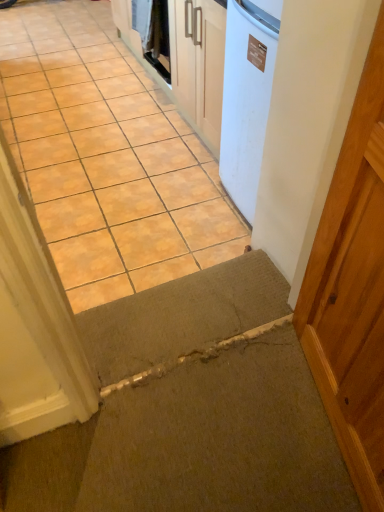
What do you see at coordinates (182, 318) in the screenshot? The image size is (384, 512). I see `carpeted mat at lower center` at bounding box center [182, 318].

Measure the distance between point (x=25, y=138) and camera.

They are 8.94 feet apart.

The width and height of the screenshot is (384, 512). What do you see at coordinates (152, 26) in the screenshot?
I see `white glossy washing machine at upper center` at bounding box center [152, 26].

Where is `carpeted mat at lower center`? The image size is (384, 512). carpeted mat at lower center is located at coordinates (182, 318).

From the image's perspective, is brown concrete at center under white glossy washing machine at upper center?

Yes.

What's the angular difference between brown concrete at center and white glossy washing machine at upper center's facing directions?

brown concrete at center and white glossy washing machine at upper center are facing 90.4 degrees away from each other.

Is brown concrete at center completely or partially outside of white glossy washing machine at upper center?

Yes, brown concrete at center is located beyond the bounds of white glossy washing machine at upper center.

Is brown concrete at center closer to the viewer compared to white glossy washing machine at upper center?

Yes, brown concrete at center is in front of white glossy washing machine at upper center.

Which object is positioned more to the left, carpeted mat at lower center or brown concrete at center?

brown concrete at center is more to the left.

From the image's perspective, relative to brown concrete at center, is carpeted mat at lower center above or below?

carpeted mat at lower center is situated lower than brown concrete at center in the image.

Locate an element on the screen. This screenshot has height=512, width=384. doormat above the brown concrete at center (from a real-world perspective) is located at coordinates (182, 318).

Is carpeted mat at lower center facing towards brown concrete at center?

Yes, carpeted mat at lower center is aimed at brown concrete at center.

Is white glossy washing machine at upper center placed right next to brown concrete at center?

No, white glossy washing machine at upper center is not beside brown concrete at center.

Does white glossy washing machine at upper center turn towards brown concrete at center?

No, white glossy washing machine at upper center is not oriented towards brown concrete at center.

Which of these two, white glossy washing machine at upper center or brown concrete at center, is smaller?

With smaller size is white glossy washing machine at upper center.

Between white glossy washing machine at upper center and brown concrete at center, which one is positioned in front?

brown concrete at center is in front.

Who is more distant, white glossy washing machine at upper center or carpeted mat at lower center?

white glossy washing machine at upper center.

Would you say white glossy washing machine at upper center is a long distance from carpeted mat at lower center?

Yes, white glossy washing machine at upper center and carpeted mat at lower center are located far from each other.

Is white glossy washing machine at upper center bigger than carpeted mat at lower center?

No.

Is white glossy washing machine at upper center surrounding carpeted mat at lower center?

No, carpeted mat at lower center is not surrounded by white glossy washing machine at upper center.

Looking at this image, considering their positions, is carpeted mat at lower center located in front of or behind white glossy washing machine at upper center?

carpeted mat at lower center is positioned closer to the viewer than white glossy washing machine at upper center.

From the picture: Would you say carpeted mat at lower center is outside white glossy washing machine at upper center?

Yes.

Considering the sizes of objects carpeted mat at lower center and white glossy washing machine at upper center in the image provided, who is thinner, carpeted mat at lower center or white glossy washing machine at upper center?

Thinner between the two is white glossy washing machine at upper center.

How many degrees apart are the facing directions of carpeted mat at lower center and white glossy washing machine at upper center?

The angular difference between carpeted mat at lower center and white glossy washing machine at upper center is 88.9 degrees.

How different are the orientations of brown concrete at center and carpeted mat at lower center in degrees?

The angular difference between brown concrete at center and carpeted mat at lower center is 179 degrees.

Between brown concrete at center and carpeted mat at lower center, which one has larger width?

With larger width is brown concrete at center.

Who is smaller, brown concrete at center or carpeted mat at lower center?

carpeted mat at lower center.

Considering the positions of point (27, 138) and point (207, 289), is point (27, 138) closer or farther from the camera than point (207, 289)?

Point (27, 138).

Find the location of a particular element. The height and width of the screenshot is (512, 384). concrete on the left of white glossy washing machine at upper center is located at coordinates (106, 157).

The image size is (384, 512). In the image, there is a carpeted mat at lower center. Identify the location of concrete above it (from the image's perspective). 106,157.

Based on the photo, estimate the real-world distances between objects in this image. Which object is closer to brown concrete at center, white glossy washing machine at upper center or carpeted mat at lower center?

white glossy washing machine at upper center lies closer to brown concrete at center than the other object.

Based on their spatial positions, is white glossy washing machine at upper center or brown concrete at center further from carpeted mat at lower center?

white glossy washing machine at upper center.

Looking at the image, which one is located further to brown concrete at center, carpeted mat at lower center or white glossy washing machine at upper center?

Among the two, carpeted mat at lower center is located further to brown concrete at center.

Considering their positions, is brown concrete at center positioned closer to white glossy washing machine at upper center than carpeted mat at lower center?

brown concrete at center is closer to white glossy washing machine at upper center.

Based on the photo, based on their spatial positions, is carpeted mat at lower center or brown concrete at center further from white glossy washing machine at upper center?

Based on the image, carpeted mat at lower center appears to be further to white glossy washing machine at upper center.

Based on their spatial positions, is brown concrete at center or white glossy washing machine at upper center further from carpeted mat at lower center?

The object further to carpeted mat at lower center is white glossy washing machine at upper center.

At what (x,y) coordinates should I click in order to perform the action: click on concrete between white glossy washing machine at upper center and carpeted mat at lower center in the up-down direction. Please return your answer as a coordinate pair (x, y). The width and height of the screenshot is (384, 512). Looking at the image, I should click on (106, 157).